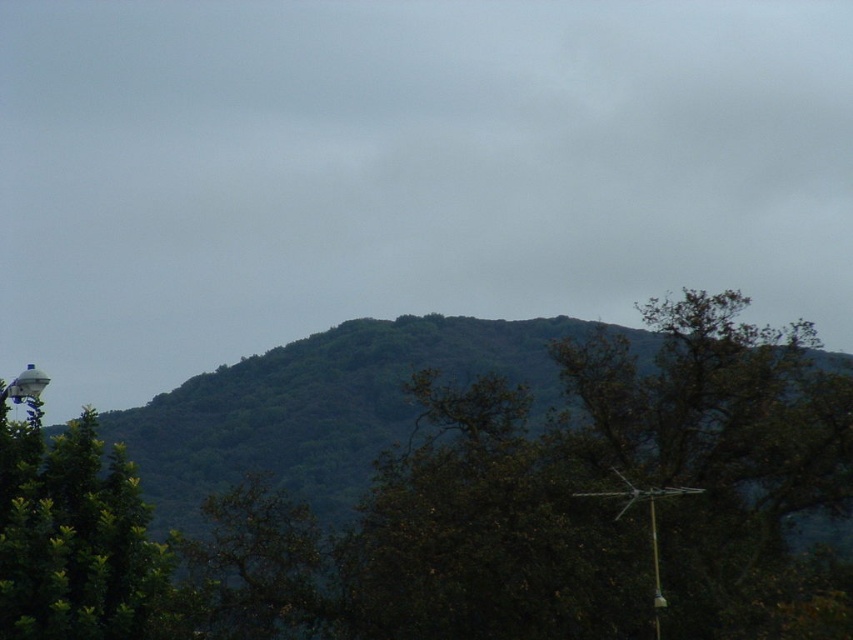
You are standing at the base of the hill and see the green leafy tree at center and the green leafy tree at left. Which tree is closer to the right edge of the image?

The green leafy tree at center is positioned on the right side of the green leafy tree at left, so the green leafy tree at center is closer to the right edge of the image.

You are standing at the point marked as point (x=479, y=509). What is directly beneath your feet?

The point (x=479, y=509) is on green leafy tree at center, so the ground beneath your feet would be part of the green leafy tree at center.